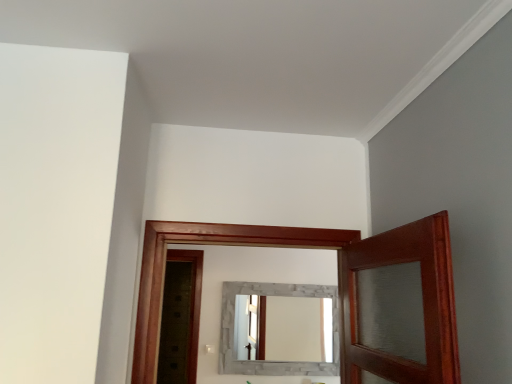
The height and width of the screenshot is (384, 512). Identify the location of white marble mirror at center. (286, 328).

Describe the element at coordinates (286, 328) in the screenshot. I see `white marble mirror at center` at that location.

Find the location of a particular element. The height and width of the screenshot is (384, 512). white marble mirror at center is located at coordinates (286, 328).